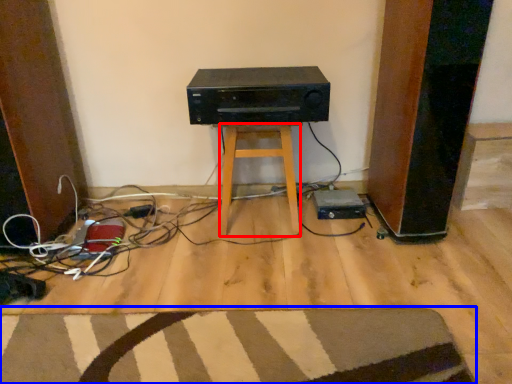
Question: Which of the following is the farthest to the observer, stool (highlighted by a red box) or doormat (highlighted by a blue box)?

Choices:
 (A) stool
 (B) doormat

Answer: (A)